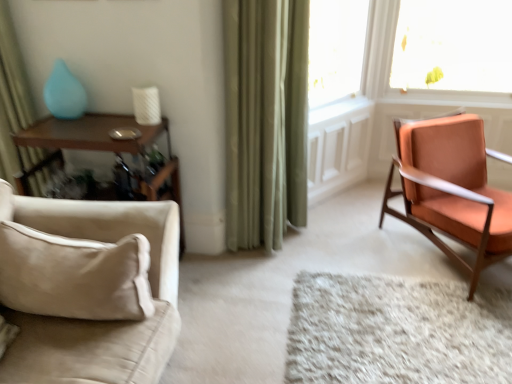
The image size is (512, 384). Find the location of `empty space that is ontop of white shag rug at center (from a real-world perspective)`. empty space that is ontop of white shag rug at center (from a real-world perspective) is located at coordinates (382, 331).